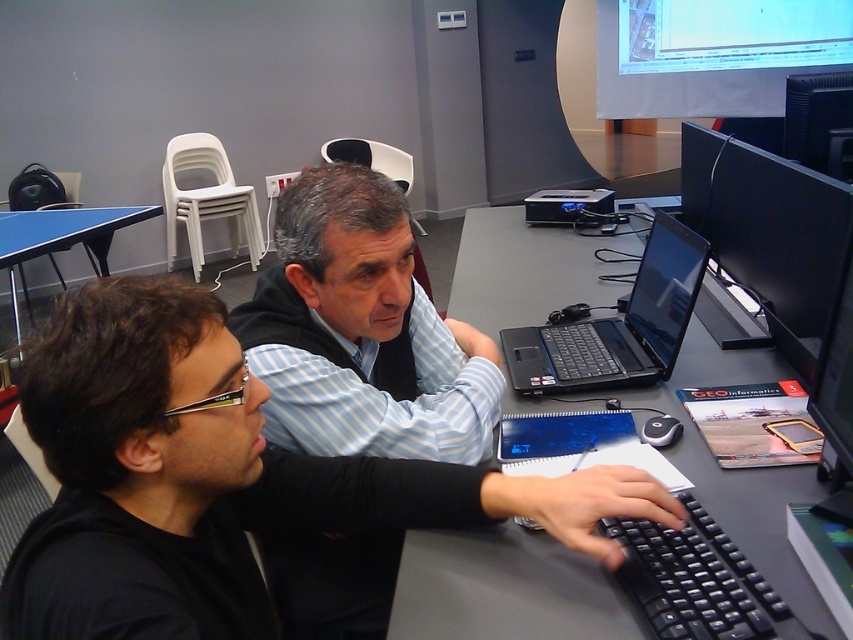
Question: Which object is the farthest from the black glossy monitor at upper right?

Choices:
 (A) black matte laptop at center
 (B) blue plastic table at left
 (C) black plastic monitor at upper right
 (D) black plastic keyboard at lower right

Answer: (B)

Question: Where is black plastic computer desk at center located in relation to blue plastic table at left in the image?

Choices:
 (A) below
 (B) above

Answer: (A)

Question: Where is black glossy monitor at upper right located in relation to black plastic monitor at upper right in the image?

Choices:
 (A) above
 (B) below

Answer: (B)

Question: Is black plastic keyboard at lower right to the right of black plastic monitor at upper right from the viewer's perspective?

Choices:
 (A) yes
 (B) no

Answer: (B)

Question: Which object is the farthest from the blue plastic table at left?

Choices:
 (A) black glossy monitor at upper right
 (B) black plastic keyboard at lower right
 (C) blue striped shirt at center
 (D) black matte shirt at center

Answer: (B)

Question: Which point is closer to the camera?

Choices:
 (A) blue plastic table at left
 (B) blue striped shirt at center
 (C) black plastic keyboard at lower right
 (D) black matte laptop at center

Answer: (C)